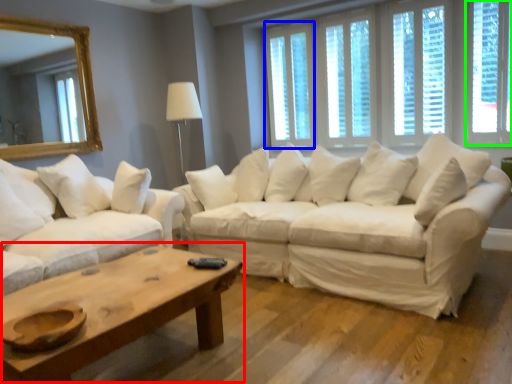
Question: Which object is the closest to the coffee table (highlighted by a red box)? Choose among these: window (highlighted by a blue box) or window (highlighted by a green box).

Choices:
 (A) window
 (B) window

Answer: (A)